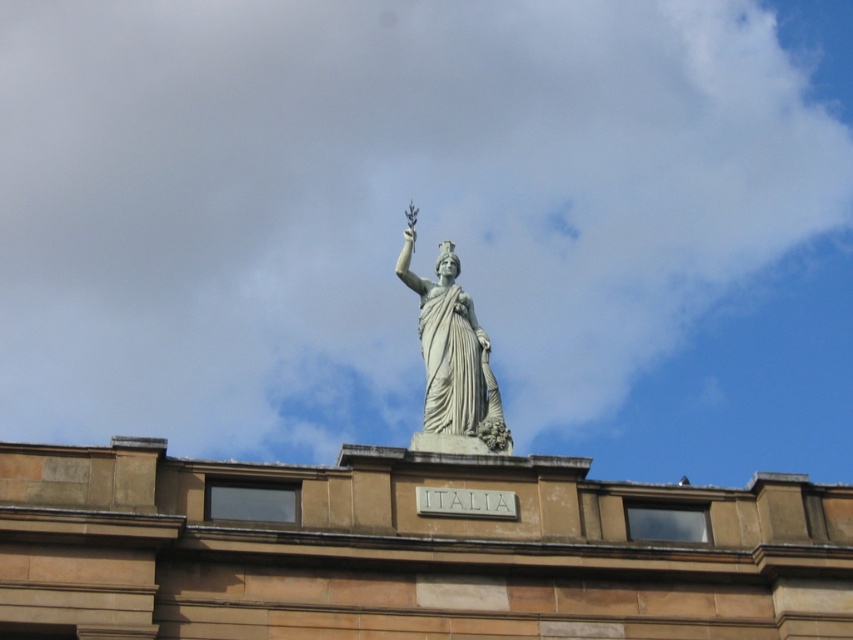
Question: Which object is closer to the camera taking this photo?

Choices:
 (A) white fluffy cloud at upper center
 (B) white marble statue at center

Answer: (B)

Question: Does white fluffy cloud at upper center have a smaller size compared to white marble statue at center?

Choices:
 (A) no
 (B) yes

Answer: (A)

Question: Is white fluffy cloud at upper center further to the viewer compared to white marble statue at center?

Choices:
 (A) yes
 (B) no

Answer: (A)

Question: Observing the image, what is the correct spatial positioning of white fluffy cloud at upper center in reference to white marble statue at center?

Choices:
 (A) above
 (B) below

Answer: (A)